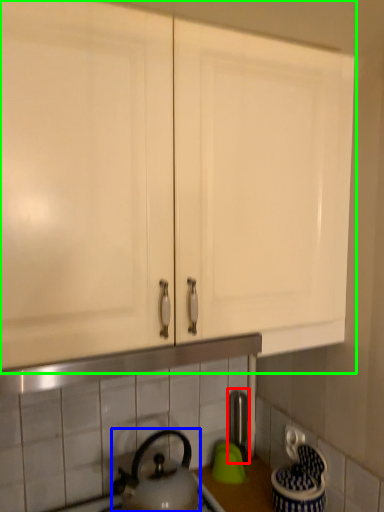
Question: Which is nearer to the faucet (highlighted by a red box)? kettle (highlighted by a blue box) or cabinetry (highlighted by a green box).

Choices:
 (A) kettle
 (B) cabinetry

Answer: (A)